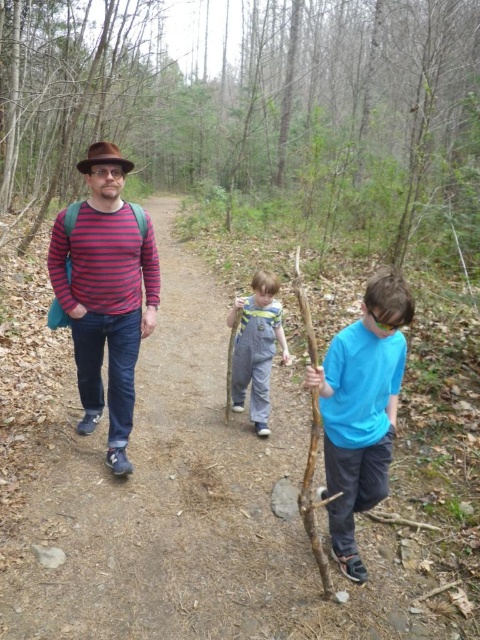
Question: Does blue cotton shirt at center have a lesser width compared to denim overalls at center?

Choices:
 (A) yes
 (B) no

Answer: (B)

Question: Is striped cotton shirt at center positioned before blue cotton shirt at center?

Choices:
 (A) no
 (B) yes

Answer: (A)

Question: Considering the real-world distances, which object is farthest from the striped cotton shirt at center?

Choices:
 (A) denim overalls at center
 (B) blue cotton shirt at center

Answer: (B)

Question: Which point is closer to the camera?

Choices:
 (A) striped cotton shirt at center
 (B) blue cotton shirt at center
 (C) denim overalls at center

Answer: (B)

Question: Can you confirm if blue cotton shirt at center is smaller than denim overalls at center?

Choices:
 (A) yes
 (B) no

Answer: (B)

Question: Considering the real-world distances, which object is closest to the denim overalls at center?

Choices:
 (A) blue cotton shirt at center
 (B) striped cotton shirt at center

Answer: (B)